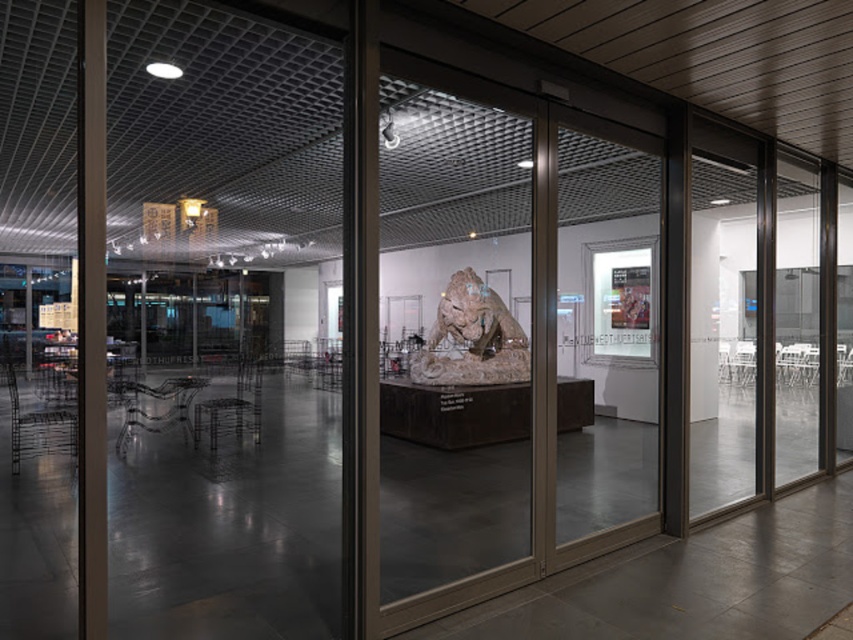
Question: Can you confirm if transparent glass door at center is positioned to the right of rustic stone lion at center?

Choices:
 (A) yes
 (B) no

Answer: (A)

Question: Considering the relative positions of transparent glass door at center and rustic stone lion at center in the image provided, where is transparent glass door at center located with respect to rustic stone lion at center?

Choices:
 (A) below
 (B) above

Answer: (B)

Question: Which object appears closest to the camera in this image?

Choices:
 (A) transparent glass door at center
 (B) rustic stone lion at center

Answer: (A)

Question: Does transparent glass door at center appear on the left side of rustic stone lion at center?

Choices:
 (A) no
 (B) yes

Answer: (A)